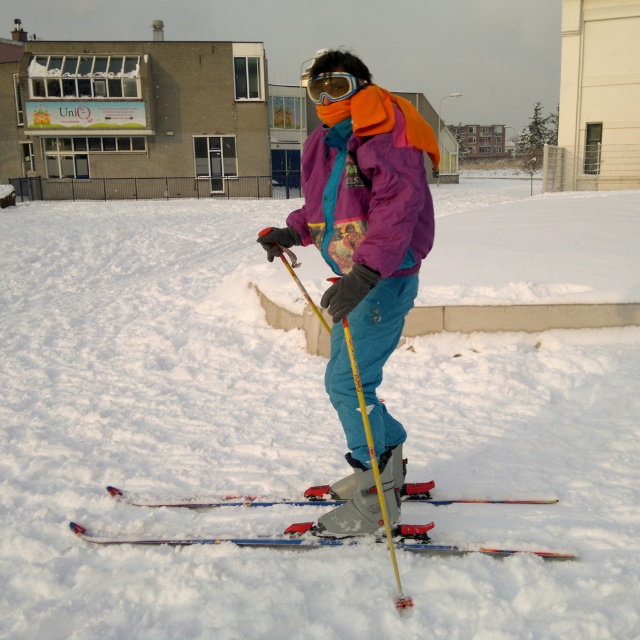
Question: Which object is farther from the camera taking this photo?

Choices:
 (A) multicolored plastic skis at center
 (B) purple matte jacket at center

Answer: (A)

Question: Does purple matte jacket at center come behind yellow plastic ski pole at center?

Choices:
 (A) yes
 (B) no

Answer: (B)

Question: Among these points, which one is nearest to the camera?

Choices:
 (A) (289, 262)
 (B) (419, 230)

Answer: (B)

Question: Which object appears farthest from the camera in this image?

Choices:
 (A) yellow plastic ski pole at center
 (B) white fluffy snow at center
 (C) purple fleece jacket at center

Answer: (B)

Question: Considering the relative positions of white fluffy snow at center and purple fleece jacket at center in the image provided, where is white fluffy snow at center located with respect to purple fleece jacket at center?

Choices:
 (A) above
 (B) below

Answer: (A)

Question: Can you confirm if purple fleece jacket at center is smaller than yellow plastic ski pole at center?

Choices:
 (A) no
 (B) yes

Answer: (B)